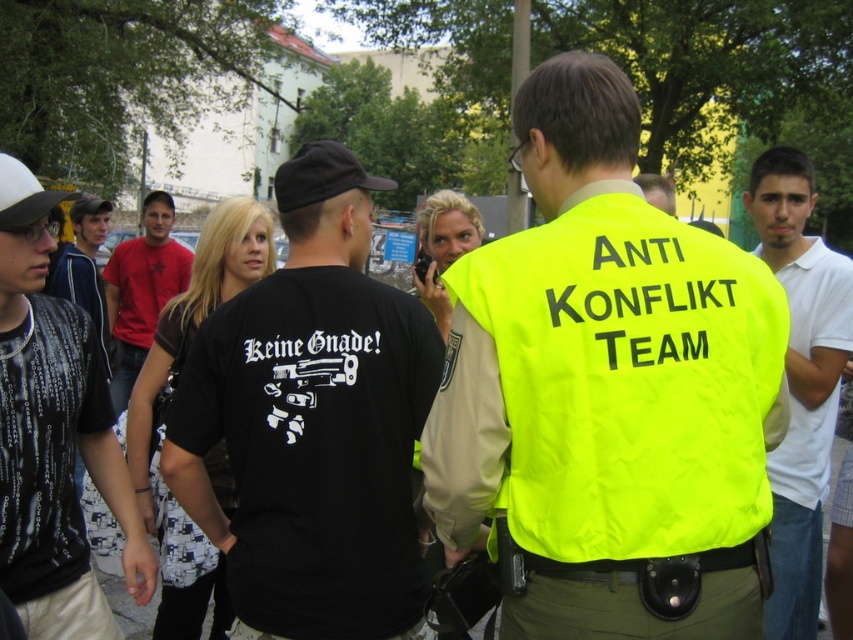
Is white cotton shirt at right shorter than matte red t-shirt at center?

In fact, white cotton shirt at right may be taller than matte red t-shirt at center.

Who is shorter, white cotton shirt at right or matte red t-shirt at center?

matte red t-shirt at center

Is point (799, 490) closer to viewer compared to point (167, 221)?

Yes, point (799, 490) is in front of point (167, 221).

Locate an element on the screen. white cotton shirt at right is located at coordinates (799, 380).

Is white cotton shirt at right shorter than black textured shirt at left?

Incorrect, white cotton shirt at right's height does not fall short of black textured shirt at left's.

Can you confirm if white cotton shirt at right is smaller than black textured shirt at left?

Indeed, white cotton shirt at right has a smaller size compared to black textured shirt at left.

Who is more distant from viewer, (769, 243) or (73, 260)?

The point (73, 260) is more distant.

Find the location of `white cotton shirt at right`. white cotton shirt at right is located at coordinates (799, 380).

Does point (577, 445) come closer to viewer compared to point (183, 264)?

Yes.

Does neon yellow vest at center have a greater width compared to matte red t-shirt at center?

Yes.

Is point (506, 365) in front of point (119, 320)?

Yes, point (506, 365) is closer to viewer.

This screenshot has width=853, height=640. Find the location of `neon yellow vest at center`. neon yellow vest at center is located at coordinates (608, 390).